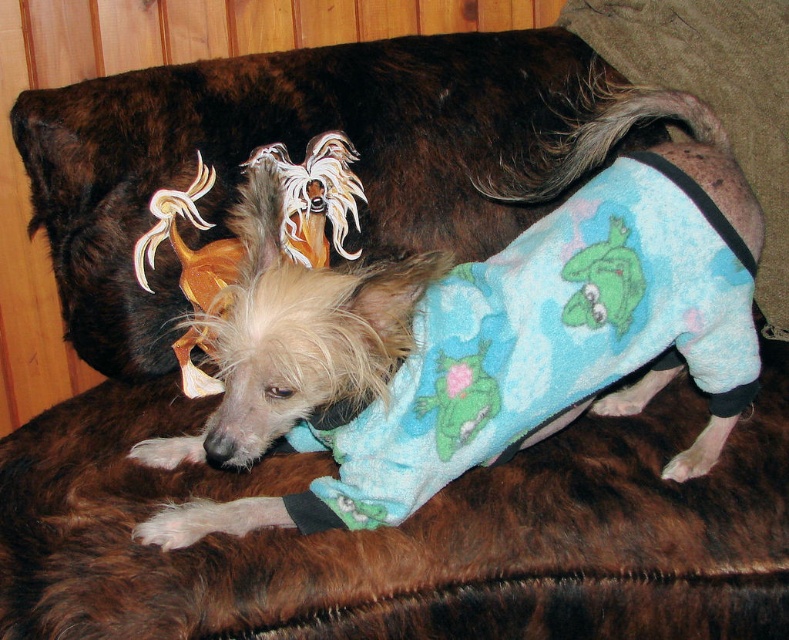
Does blue fleece pajamas at center have a lesser height compared to fuzzy blue pajamas at center?

Yes.

How distant is blue fleece pajamas at center from fuzzy blue pajamas at center?

They are 18.92 centimeters apart.

The image size is (789, 640). What do you see at coordinates (546, 340) in the screenshot? I see `blue fleece pajamas at center` at bounding box center [546, 340].

This screenshot has height=640, width=789. Identify the location of blue fleece pajamas at center. (546, 340).

Does point (406, 260) come farther from viewer compared to point (614, 244)?

That is False.

Identify the location of fuzzy blue pajamas at center. The height and width of the screenshot is (640, 789). click(x=290, y=310).

Is blue fleece pajamas at center to the right of green plush frog at upper center from the viewer's perspective?

In fact, blue fleece pajamas at center is to the left of green plush frog at upper center.

Consider the image. Which is more to the right, blue fleece pajamas at center or green plush frog at upper center?

green plush frog at upper center

Is point (518, 433) positioned in front of point (578, 257)?

No, (518, 433) is behind (578, 257).

Image resolution: width=789 pixels, height=640 pixels. I want to click on blue fleece pajamas at center, so pyautogui.click(x=546, y=340).